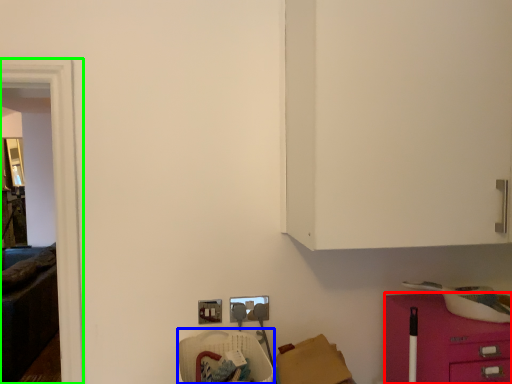
Question: Based on their relative distances, which object is nearer to furniture (highlighted by a red box)? Choose from armchair (highlighted by a blue box) and glass door (highlighted by a green box).

Choices:
 (A) armchair
 (B) glass door

Answer: (A)